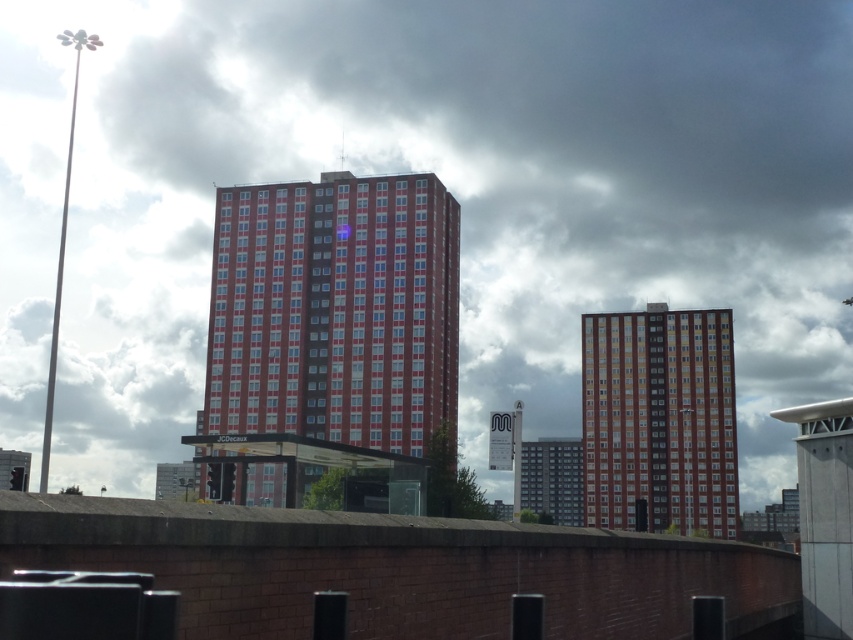
You are a city planner analyzing the urban layout. You need to determine which building has a wider footprint between the red brick building at center and the brick textured building at center. Based on the scene, which one is wider?

The brick textured building at center has a greater width than the red brick building at center, making it the wider of the two.